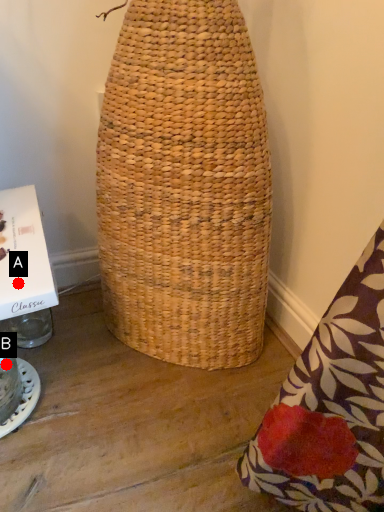
Question: Two points are circled on the image, labeled by A and B beside each circle. Which point is closer to the camera?

Choices:
 (A) A is closer
 (B) B is closer

Answer: (A)